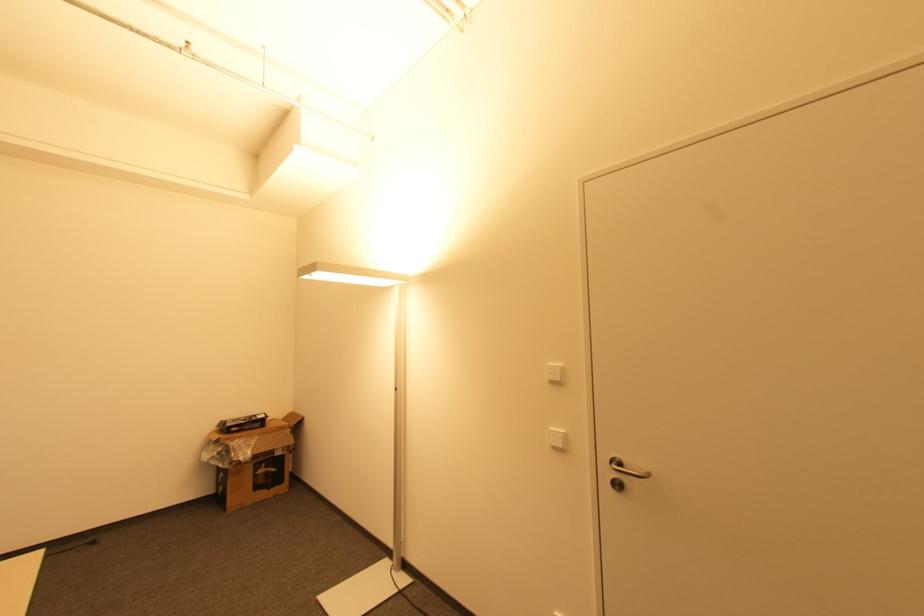
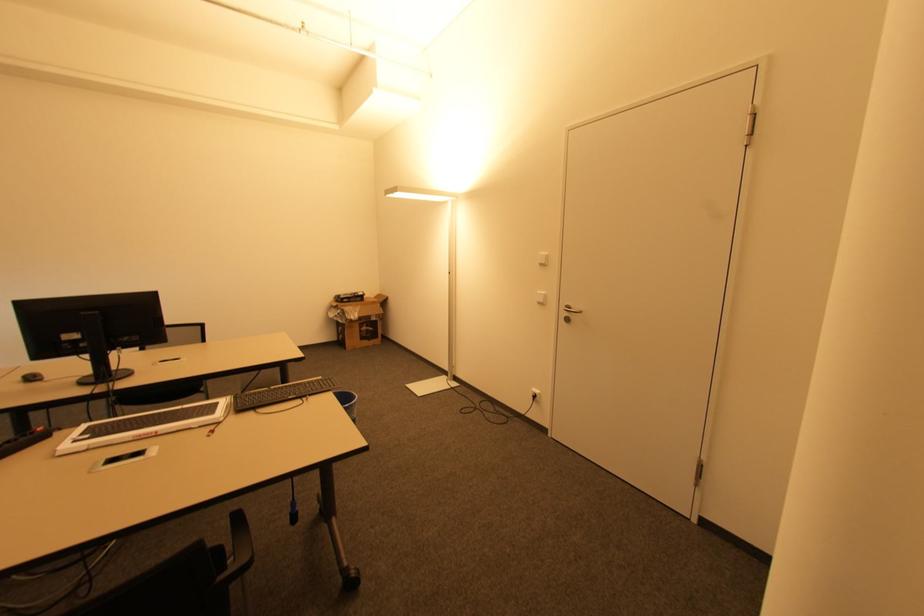
Find the pixel in the second image that matches pixel 268 472 in the first image.

(369, 331)